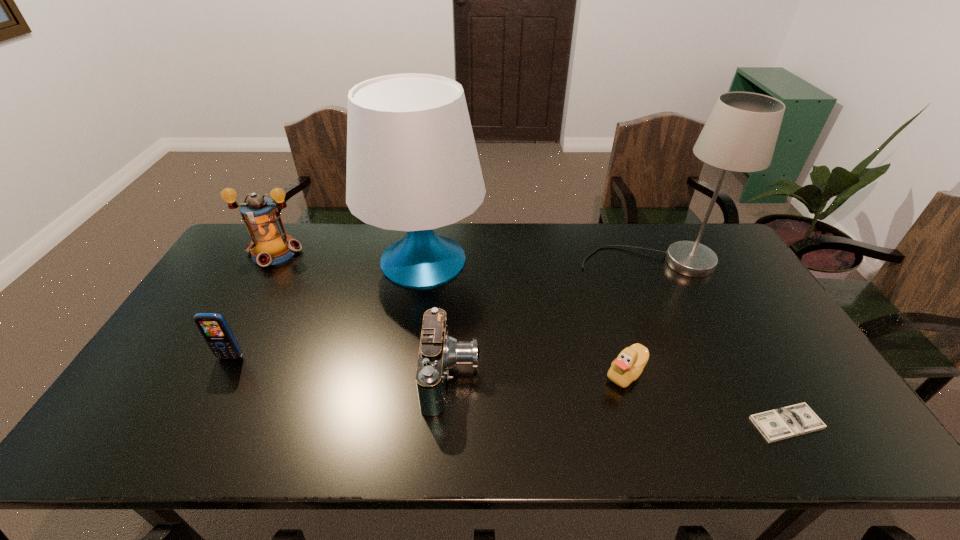
Where is `vacant region between the right table lamp and the dollar`? vacant region between the right table lamp and the dollar is located at coordinates (718, 343).

I want to click on vacant area between the left table lamp and the shortest object, so click(x=605, y=341).

Find the location of `free space that is in between the dollar and the right table lamp`. free space that is in between the dollar and the right table lamp is located at coordinates (718, 343).

Image resolution: width=960 pixels, height=540 pixels. Identify the location of free space between the camcorder and the cellular telephone. (341, 367).

What are the coordinates of `free space between the right table lamp and the camcorder` in the screenshot? It's located at (551, 319).

Find the location of a particular element. The image size is (960, 540). vacant area that lies between the second shortest object and the camcorder is located at coordinates (539, 375).

I want to click on free space between the dollar and the left table lamp, so (x=605, y=341).

Identify the location of vacant area between the duck and the lantern. [450, 312].

Locate which object is the fifth closest to the shortest object. Please provide its 2D coordinates. Your answer should be formatted as a tuple, i.e. [(x, y)], where the tuple contains the x and y coordinates of a point satisfying the conditions above.

[(213, 327)]

Choose which object is the third nearest neighbor to the duck. Please provide its 2D coordinates. Your answer should be formatted as a tuple, i.e. [(x, y)], where the tuple contains the x and y coordinates of a point satisfying the conditions above.

[(439, 352)]